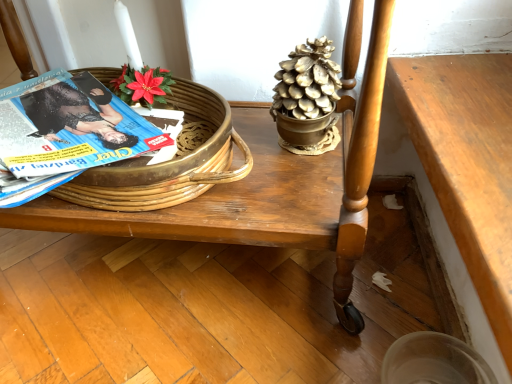
Question: From the image's perspective, is gold metallic pinecone at upper center over wooden table at center?

Choices:
 (A) no
 (B) yes

Answer: (B)

Question: Is gold metallic pinecone at upper center turned away from wooden table at center?

Choices:
 (A) no
 (B) yes

Answer: (B)

Question: Is gold metallic pinecone at upper center facing towards wooden table at center?

Choices:
 (A) no
 (B) yes

Answer: (B)

Question: Is gold metallic pinecone at upper center not near wooden table at center?

Choices:
 (A) yes
 (B) no

Answer: (B)

Question: From the image's perspective, does gold metallic pinecone at upper center appear lower than wooden table at center?

Choices:
 (A) yes
 (B) no

Answer: (B)

Question: Considering the relative positions of gold metallic pinecone at upper center and wooden table at center in the image provided, is gold metallic pinecone at upper center to the left of wooden table at center from the viewer's perspective?

Choices:
 (A) yes
 (B) no

Answer: (B)

Question: Is woven wood basket at upper left positioned with its back to blue glossy magazine at left?

Choices:
 (A) yes
 (B) no

Answer: (A)

Question: From a real-world perspective, is woven wood basket at upper left positioned over blue glossy magazine at left based on gravity?

Choices:
 (A) yes
 (B) no

Answer: (B)

Question: Is woven wood basket at upper left outside of blue glossy magazine at left?

Choices:
 (A) yes
 (B) no

Answer: (B)

Question: Considering the relative sizes of woven wood basket at upper left and blue glossy magazine at left in the image provided, is woven wood basket at upper left shorter than blue glossy magazine at left?

Choices:
 (A) no
 (B) yes

Answer: (A)

Question: Is woven wood basket at upper left bigger than blue glossy magazine at left?

Choices:
 (A) yes
 (B) no

Answer: (A)

Question: Is woven wood basket at upper left far from blue glossy magazine at left?

Choices:
 (A) no
 (B) yes

Answer: (A)

Question: Is gold metallic pinecone at upper center directly adjacent to woven wood basket at upper left?

Choices:
 (A) yes
 (B) no

Answer: (B)